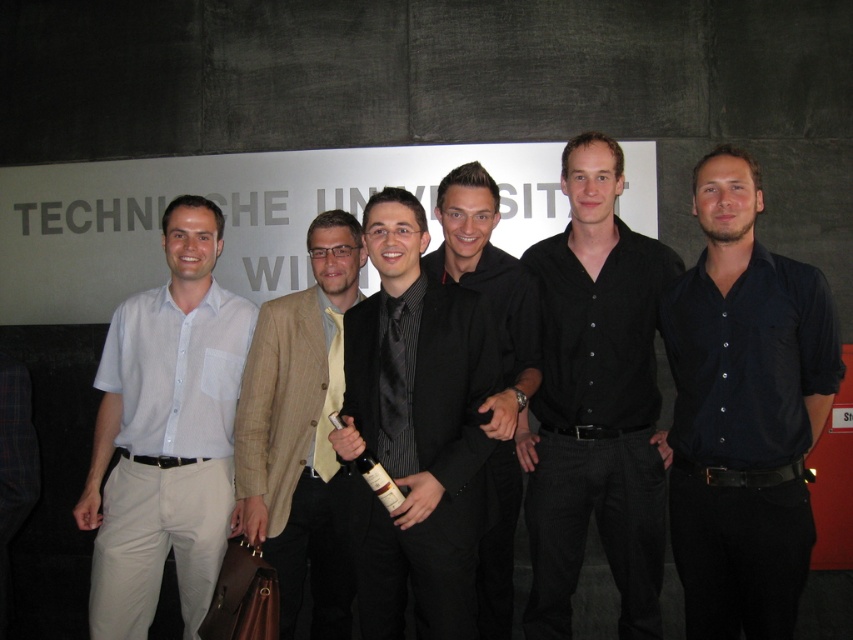
Question: Among these objects, which one is farthest from the camera?

Choices:
 (A) black matte shirt at right
 (B) black satin suit at center

Answer: (A)

Question: Does black satin suit at center have a lesser width compared to tan textured blazer at center?

Choices:
 (A) yes
 (B) no

Answer: (B)

Question: Is the position of black matte shirt at right less distant than that of white cotton shirt at left?

Choices:
 (A) yes
 (B) no

Answer: (A)

Question: Which point is closer to the camera taking this photo?

Choices:
 (A) (198, 500)
 (B) (306, 541)

Answer: (A)

Question: Which point is farther from the camera taking this photo?

Choices:
 (A) (419, 360)
 (B) (601, 204)

Answer: (B)

Question: Observing the image, what is the correct spatial positioning of black matte shirt at right in reference to black matte shirt at center?

Choices:
 (A) left
 (B) right

Answer: (B)